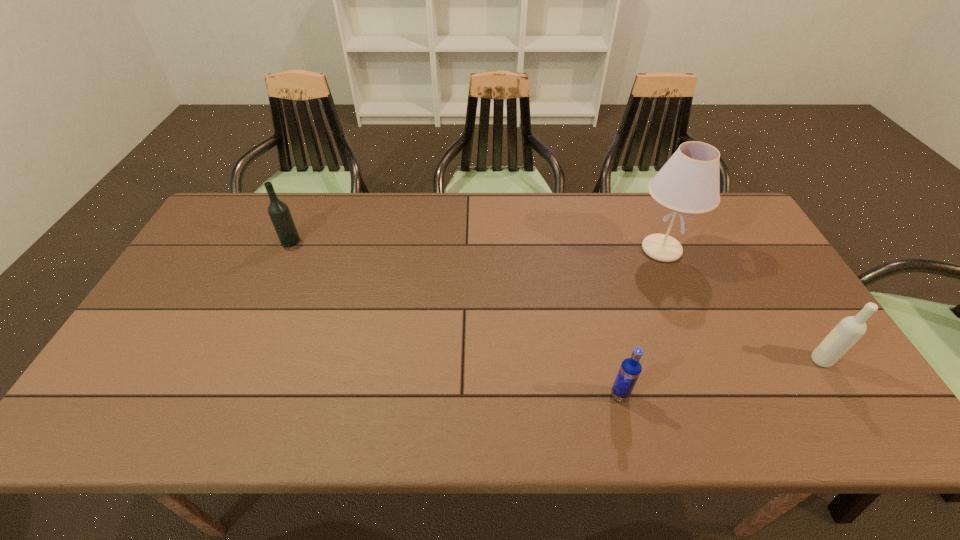
You are a GUI agent. You are given a task and a screenshot of the screen. Output one action in this format:
    pyautogui.click(x=<x>, y=<y>)
    Task: Click on the free space at the far right corner of the desktop
    Image resolution: width=960 pixels, height=540 pixels.
    Given the screenshot: What is the action you would take?
    pyautogui.click(x=734, y=233)

Where is `vacant point located between the nearest vodka and the leftmost object`? The width and height of the screenshot is (960, 540). vacant point located between the nearest vodka and the leftmost object is located at coordinates (455, 318).

Locate an element on the screen. The width and height of the screenshot is (960, 540). vacant space that is in between the lampshade and the second nearest object is located at coordinates (741, 305).

Find the location of a particular element. empty space that is in between the lampshade and the leftmost object is located at coordinates (476, 246).

This screenshot has height=540, width=960. In order to click on free space between the lampshade and the shortest vodka in this screenshot , I will do `click(640, 322)`.

You are a GUI agent. You are given a task and a screenshot of the screen. Output one action in this format:
    pyautogui.click(x=<x>, y=<y>)
    Task: Click on the free space between the shortest vodka and the second farthest vodka
    This screenshot has height=540, width=960.
    Given the screenshot: What is the action you would take?
    pyautogui.click(x=720, y=378)

Find the location of a particular element. Image resolution: width=960 pixels, height=540 pixels. free spot between the second nearest object and the leftmost vodka is located at coordinates (556, 301).

Find the location of `free area in between the third object from left to right and the second nearest object`. free area in between the third object from left to right and the second nearest object is located at coordinates (741, 305).

Find the location of a particular element. The image size is (960, 540). vacant area that lies between the lampshade and the farthest vodka is located at coordinates (476, 246).

Where is `free space between the tallest object and the leftmost object`? free space between the tallest object and the leftmost object is located at coordinates (476, 246).